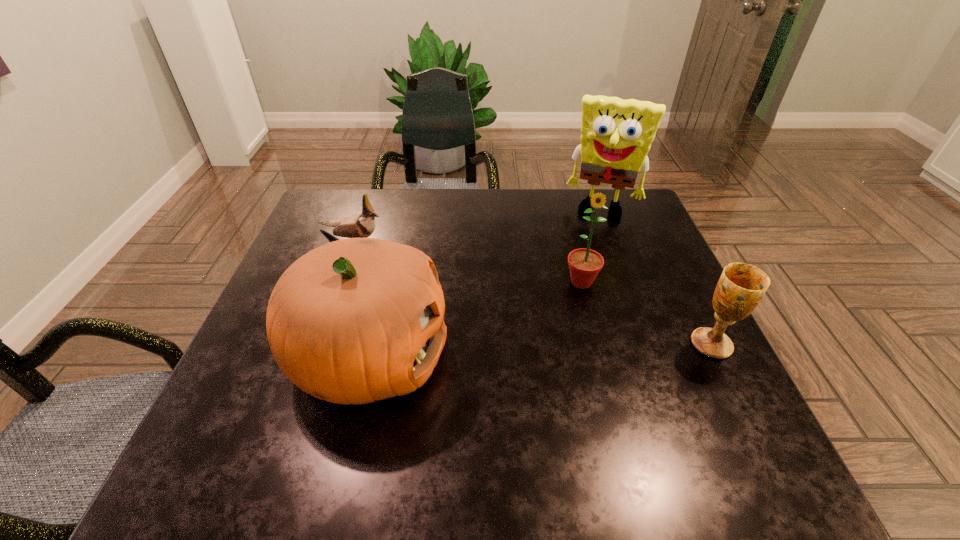
This screenshot has height=540, width=960. Find the location of `pumpkin present at the left edge`. pumpkin present at the left edge is located at coordinates (353, 321).

The image size is (960, 540). Find the location of `bird present at the left edge`. bird present at the left edge is located at coordinates (362, 224).

At what (x,y) coordinates should I click in order to perform the action: click on chalice that is at the right edge. Please return your answer as a coordinate pair (x, y). The height and width of the screenshot is (540, 960). Looking at the image, I should click on (741, 286).

Where is `sponge situated at the right edge`? The image size is (960, 540). sponge situated at the right edge is located at coordinates (616, 135).

Where is `object that is at the far left corner`? This screenshot has height=540, width=960. object that is at the far left corner is located at coordinates (362, 224).

This screenshot has height=540, width=960. What are the coordinates of `object positioned at the near left corner` in the screenshot? It's located at (353, 321).

At what (x,y) coordinates should I click in order to perform the action: click on object present at the far right corner. Please return your answer as a coordinate pair (x, y). Looking at the image, I should click on (616, 135).

Find the location of a particular element. The height and width of the screenshot is (540, 960). vacant space at the far edge is located at coordinates (540, 220).

Image resolution: width=960 pixels, height=540 pixels. In the image, there is a desktop. In order to click on vacant space at the near edge in this screenshot , I will do `click(531, 421)`.

In the image, there is a desktop. Where is `vacant space at the left edge`? The width and height of the screenshot is (960, 540). vacant space at the left edge is located at coordinates pyautogui.click(x=264, y=340).